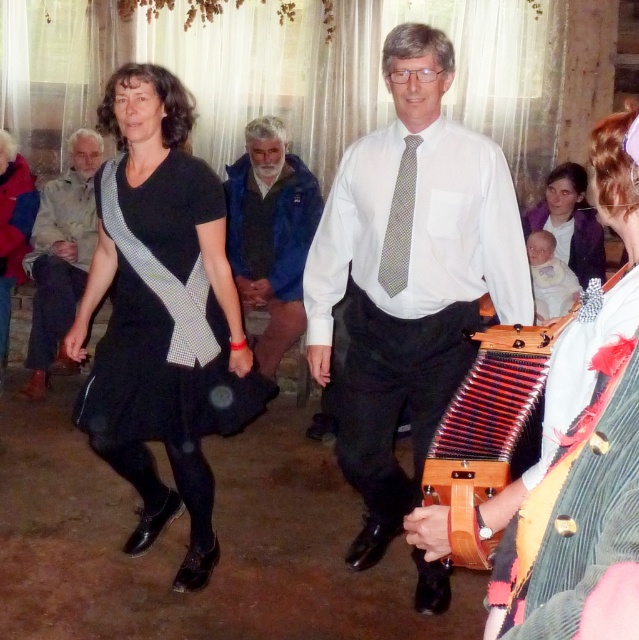
You are a photographer at the event and want to capture a photo of both the black checkered dress at center and the gray dotted tie at center in the same frame. The camera has a minimum focus distance of 30 inches. Will both subjects be in focus?

The black checkered dress at center and the gray dotted tie at center are 31.80 inches apart. Since the distance between them is greater than the camera minimum focus distance of 30 inches, both subjects will be in focus.

You are organizing a coat rack and need to hang the light brown leather jacket at left and the gray dotted tie at center. Since the coat rack has limited vertical space, which item should you hang first to maximize space efficiency?

The light brown leather jacket at left has a greater height compared to the gray dotted tie at center, so you should hang the light brown leather jacket at left first to accommodate its larger height before placing the shorter gray dotted tie at center.

You are a photographer setting up a camera in the center of the room. You need to ensure both the black checkered dress at center and the wooden accordion at center are fully visible in the frame. Given their sizes, which object requires a wider angle lens to capture its full width?

The black checkered dress at center requires a wider angle lens because its width is larger than the wooden accordion at center, necessitating a wider field of view to capture it fully.